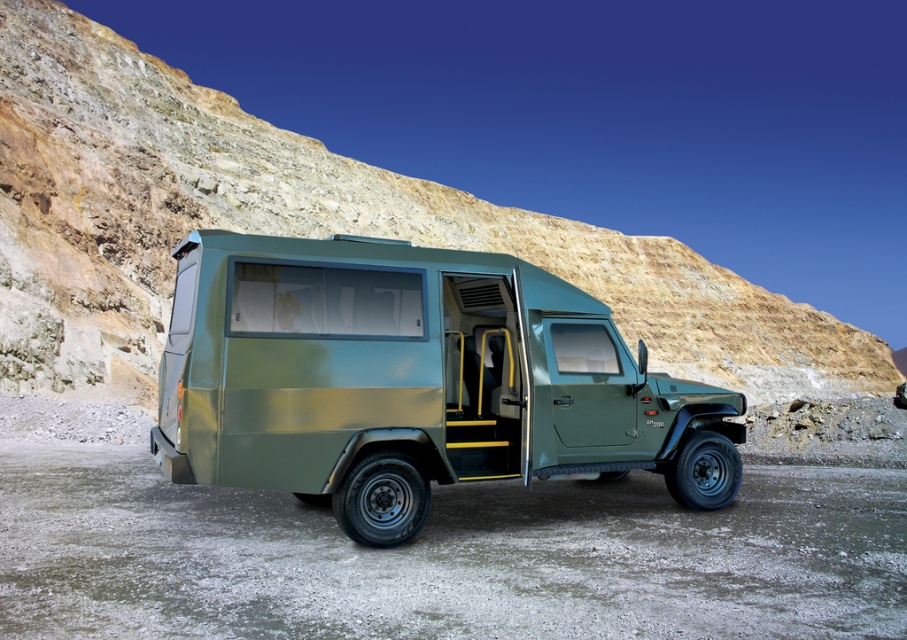
You are a GUI agent. You are given a task and a screenshot of the screen. Output one action in this format:
    pyautogui.click(x=<x>, y=<y>)
    Task: Click on the matte green truck at center
    The image size is (907, 640).
    Given the screenshot: What is the action you would take?
    pyautogui.click(x=301, y=228)

Between matte green truck at center and green matte jeep at center, which one appears on the right side from the viewer's perspective?

matte green truck at center

What do you see at coordinates (301, 228) in the screenshot?
I see `matte green truck at center` at bounding box center [301, 228].

Identify the location of matte green truck at center. The image size is (907, 640). (301, 228).